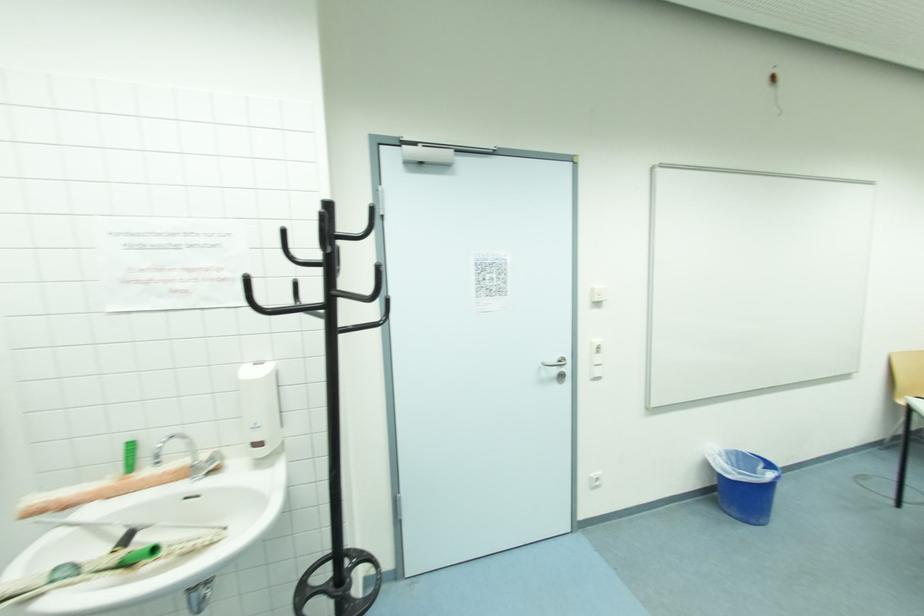
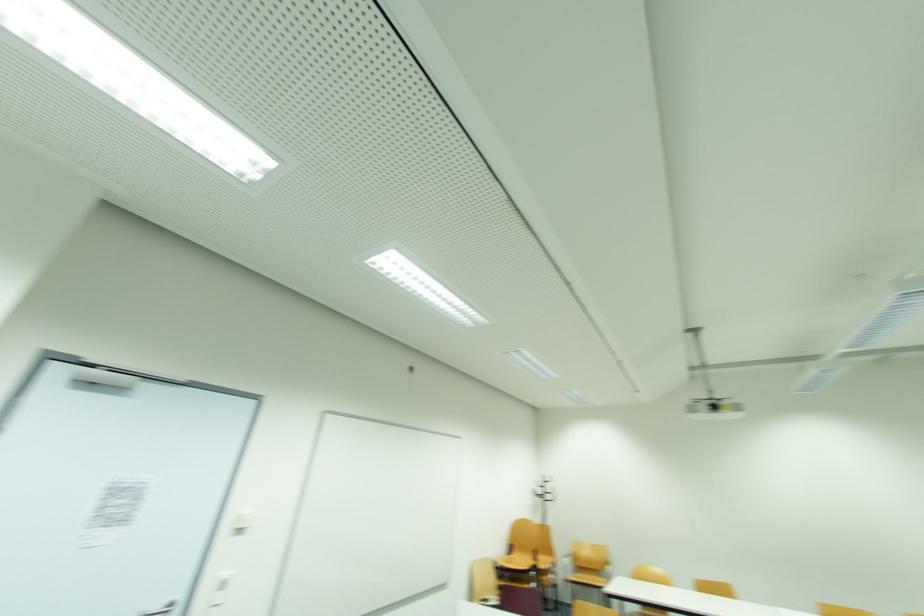
First-person continuous shooting, in which direction is the camera rotating?

The camera rotated toward right-up.